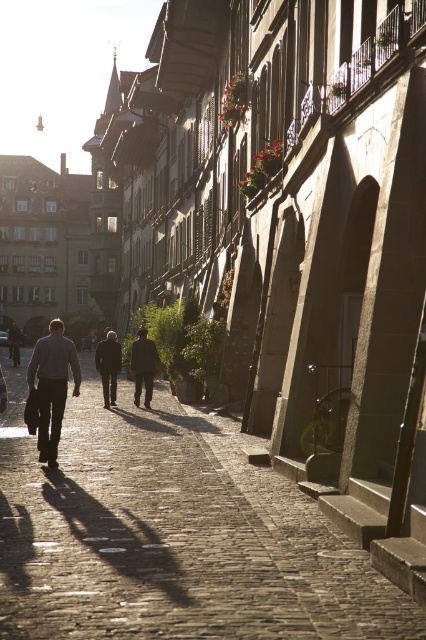
Which of these two, gray woolen sweater at center or dark brown suit at center, stands taller?

gray woolen sweater at center is taller.

Is gray woolen sweater at center taller than dark brown suit at center?

Indeed, gray woolen sweater at center has a greater height compared to dark brown suit at center.

Between point (74, 388) and point (109, 344), which one is positioned in front?

Positioned in front is point (74, 388).

I want to click on gray woolen sweater at center, so click(51, 387).

Does cobblestone pavement at center have a smaller size compared to gray woolen sweater at center?

No, cobblestone pavement at center is not smaller than gray woolen sweater at center.

Between point (135, 470) and point (42, 369), which one is positioned behind?

The point (42, 369) is behind.

Between point (170, 600) and point (66, 388), which one is positioned behind?

The point (66, 388) is more distant.

Image resolution: width=426 pixels, height=640 pixels. In order to click on cobblestone pavement at center in this screenshot , I will do `click(170, 534)`.

Can you confirm if dark brown leather jacket at center is shorter than dark brown suit at center?

No.

The width and height of the screenshot is (426, 640). Find the location of `dark brown leather jacket at center`. dark brown leather jacket at center is located at coordinates (143, 365).